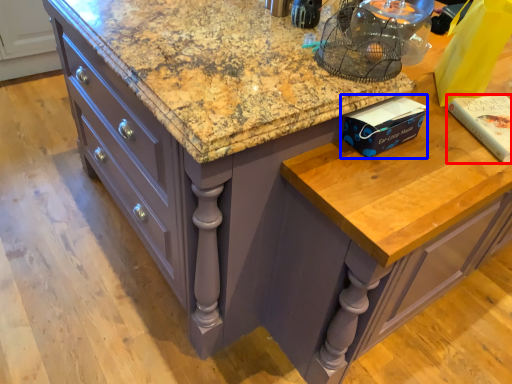
Question: Which of the following is the closest to the observer, book (highlighted by a red box) or book (highlighted by a blue box)?

Choices:
 (A) book
 (B) book

Answer: (B)